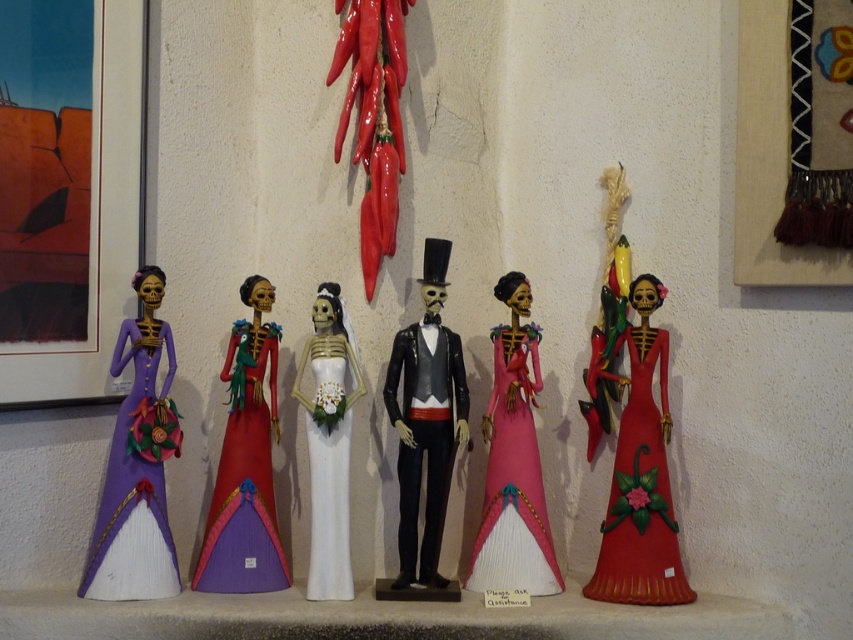
You are a visitor at an art exhibition and see the two figurines in the center of the image. The shiny black suit at center and the white matte wedding dress at center. Which one is positioned higher?

The shiny black suit at center is located above the white matte wedding dress at center, so it is positioned higher.

You are standing in front of a display of Day of the Dead figurines. You see a shiny black suit at center and a white matte wedding dress at center. Which figurine is closer to you?

The shiny black suit at center is closer to you because it is further to the viewer than the white matte wedding dress at center.

Looking at this image, you are standing in front of the row of colorful skeleton figurines arranged against the wall. You notice two points marked on the wall at coordinates point (137,387) and point (508,412). Which of these points is closer to you?

Point (137,387) is in front of point (508,412), so it is closer to you.